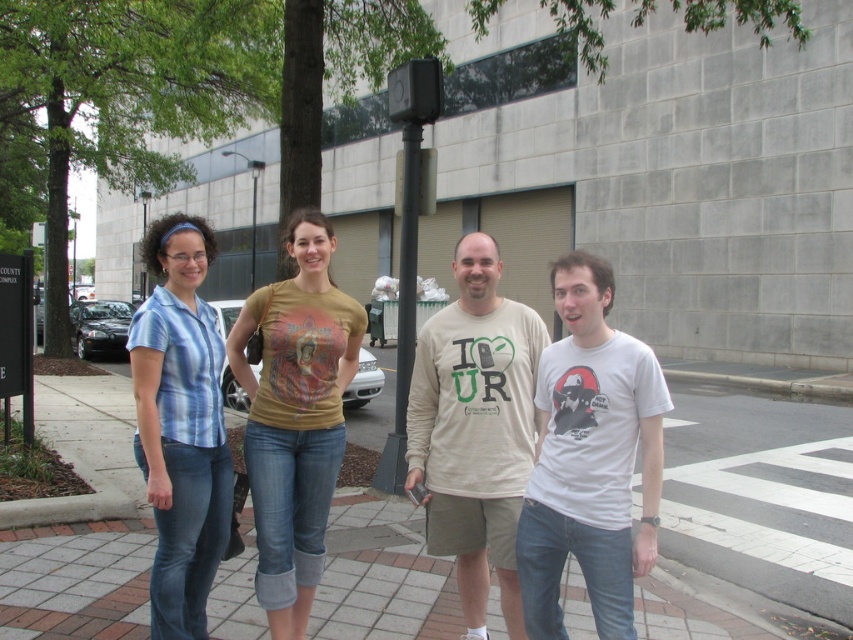
You are standing on the sidewalk and want to take a photo of the group of four individuals near the brick pavement at center. Where should you position yourself to ensure the entire group is in frame?

Position yourself at a point slightly behind the brick pavement at center to capture the entire group in the frame.

You are standing at the camera position and want to walk to the brick pavement at lower center. How many steps would you need to take if each step is 2.22 feet long?

The distance between the camera and the brick pavement at lower center is 10.88 feet. Since each step covers 2.22 feet, dividing 10.88 by 2.22 gives approximately 4.9 steps. Therefore, you would need to take about 5 steps to reach the brick pavement at lower center.

You are a delivery person trying to park your bike. You see two areas of brick pavement at center and brick pavement at lower center. Which area is wider and suitable for parking?

The brick pavement at center might be wider than brick pavement at lower center, so it is more suitable for parking.